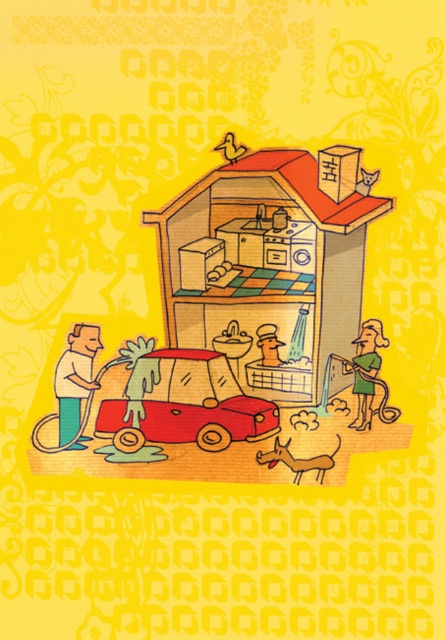
Is rubber car at center taller than brown furry dog at lower center?

Yes.

Is rubber car at center thinner than brown furry dog at lower center?

No.

Is point (371, 448) positioned in front of point (305, 465)?

That is False.

Find the location of a particular element. rubber car at center is located at coordinates (243, 330).

Consider the image. Who is more distant from viewer, (126, 385) or (264, 456)?

Point (264, 456)

Where is `shiny red car at lower center`? This screenshot has width=446, height=640. shiny red car at lower center is located at coordinates (185, 403).

The width and height of the screenshot is (446, 640). Identify the location of shiny red car at lower center. (185, 403).

Looking at this image, can you confirm if green rubber hose at lower right is wider than yellow rubber duck at upper center?

Indeed, green rubber hose at lower right has a greater width compared to yellow rubber duck at upper center.

Find the location of a particular element. Image resolution: width=446 pixels, height=640 pixels. green rubber hose at lower right is located at coordinates (367, 374).

What are the coordinates of `green rubber hose at lower right` in the screenshot? It's located at (367, 374).